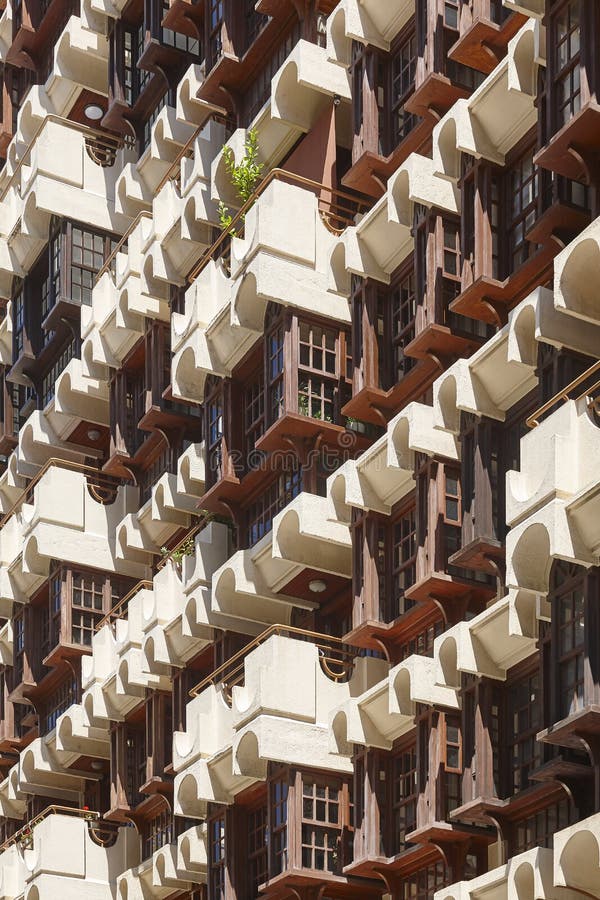
I want to click on lights, so click(x=93, y=110), click(x=315, y=588).